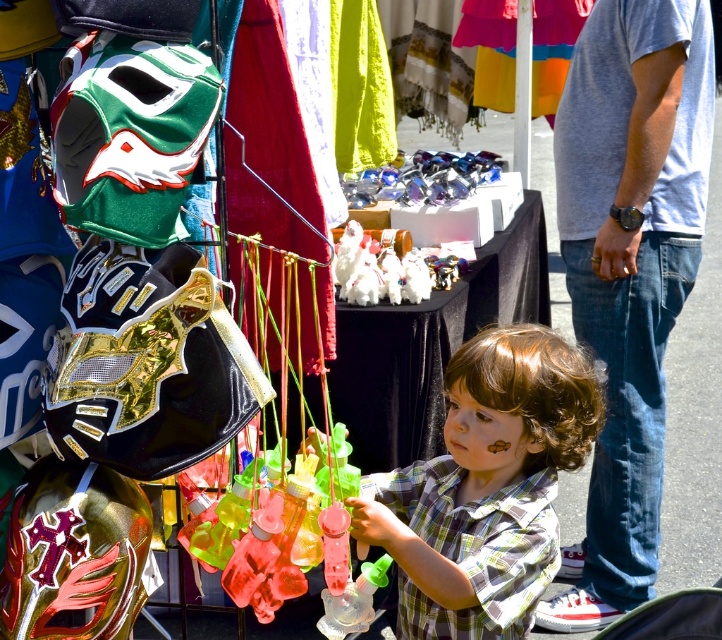
Who is more forward, [401,476] or [342,285]?

Point [401,476] is in front.

Between plaid shirt toddler at center and white plush toy at center, which one has less height?

white plush toy at center

I want to click on plaid shirt toddler at center, so (x=487, y=486).

Is point (596, 88) closer to viewer compared to point (505, 472)?

No, it is behind (505, 472).

Can you confirm if gray cotton t-shirt at right is wider than plaid shirt toddler at center?

No, gray cotton t-shirt at right is not wider than plaid shirt toddler at center.

Between point (595, 317) and point (521, 506), which one is positioned in front?

Point (521, 506) is more forward.

The image size is (722, 640). What are the coordinates of `gray cotton t-shirt at right` in the screenshot? It's located at (630, 268).

Is gray cotton t-shirt at right to the left of white plush toy at center from the viewer's perspective?

In fact, gray cotton t-shirt at right is to the right of white plush toy at center.

Between gray cotton t-shirt at right and white plush toy at center, which one has less height?

white plush toy at center

Which is in front, point (645, 502) or point (370, 252)?

Point (645, 502)

What are the coordinates of `gray cotton t-shirt at right` in the screenshot? It's located at (630, 268).